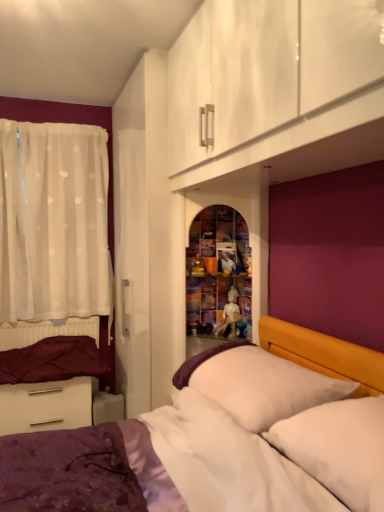
Question: Are white glossy drawer at lower left and purple velvet bed at lower left far apart?

Choices:
 (A) no
 (B) yes

Answer: (B)

Question: Is white glossy drawer at lower left outside of purple velvet bed at lower left?

Choices:
 (A) no
 (B) yes

Answer: (B)

Question: Would you say purple velvet bed at lower left is part of white glossy drawer at lower left's contents?

Choices:
 (A) no
 (B) yes

Answer: (A)

Question: Can you confirm if white glossy drawer at lower left is shorter than purple velvet bed at lower left?

Choices:
 (A) no
 (B) yes

Answer: (B)

Question: Can you confirm if white glossy drawer at lower left is thinner than purple velvet bed at lower left?

Choices:
 (A) yes
 (B) no

Answer: (A)

Question: Is white glossy drawer at lower left looking in the opposite direction of purple velvet bed at lower left?

Choices:
 (A) yes
 (B) no

Answer: (B)

Question: Is matte white bed frame at lower left located outside white sheer curtain at left?

Choices:
 (A) no
 (B) yes

Answer: (B)

Question: Is matte white bed frame at lower left not close to white sheer curtain at left?

Choices:
 (A) yes
 (B) no

Answer: (B)

Question: Is matte white bed frame at lower left smaller than white sheer curtain at left?

Choices:
 (A) yes
 (B) no

Answer: (A)

Question: From the image's perspective, is matte white bed frame at lower left below white sheer curtain at left?

Choices:
 (A) no
 (B) yes

Answer: (B)

Question: Does matte white bed frame at lower left have a lesser height compared to white sheer curtain at left?

Choices:
 (A) yes
 (B) no

Answer: (A)

Question: Is matte white bed frame at lower left to the right of white sheer curtain at left from the viewer's perspective?

Choices:
 (A) yes
 (B) no

Answer: (A)

Question: Considering the relative positions of white soft pillow at right, which is the first pillow from front to back, and white glossy drawer at lower left in the image provided, is white soft pillow at right, which is the first pillow from front to back, to the right of white glossy drawer at lower left from the viewer's perspective?

Choices:
 (A) no
 (B) yes

Answer: (B)